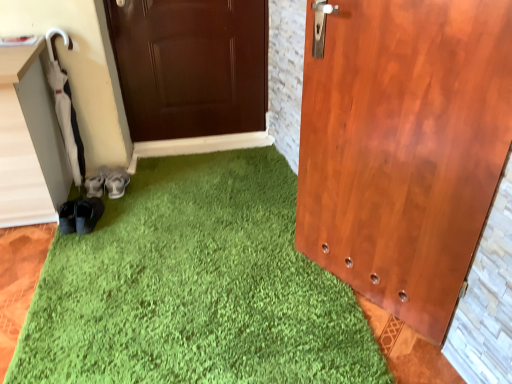
Where is `suede gray shoes at lower left, the 2th footwear in the right-to-left sequence`? The width and height of the screenshot is (512, 384). suede gray shoes at lower left, the 2th footwear in the right-to-left sequence is located at coordinates (96, 182).

The width and height of the screenshot is (512, 384). What do you see at coordinates (96, 182) in the screenshot? I see `suede gray shoes at lower left, the 1th footwear viewed from the left` at bounding box center [96, 182].

Describe the element at coordinates (116, 182) in the screenshot. I see `gray fabric shoes at lower left, positioned as the first footwear in right-to-left order` at that location.

How much space does gray fabric shoes at lower left, positioned as the first footwear in right-to-left order, occupy horizontally?

gray fabric shoes at lower left, positioned as the first footwear in right-to-left order, is 12.84 inches wide.

Locate an element on the screen. gray fabric shoes at lower left, positioned as the first footwear in right-to-left order is located at coordinates (116, 182).

The height and width of the screenshot is (384, 512). Find the location of `suede gray shoes at lower left, the 1th footwear viewed from the left`. suede gray shoes at lower left, the 1th footwear viewed from the left is located at coordinates (96, 182).

Is suede gray shoes at lower left, the 2th footwear in the right-to-left sequence, to the right of gray fabric shoes at lower left, which ranks as the second footwear in left-to-right order, from the viewer's perspective?

Incorrect, suede gray shoes at lower left, the 2th footwear in the right-to-left sequence, is not on the right side of gray fabric shoes at lower left, which ranks as the second footwear in left-to-right order.

Who is more distant, suede gray shoes at lower left, the 2th footwear in the right-to-left sequence, or gray fabric shoes at lower left, positioned as the first footwear in right-to-left order?

suede gray shoes at lower left, the 2th footwear in the right-to-left sequence, is more distant.

Which is farther, (92, 177) or (118, 184)?

The point (92, 177) is more distant.

From the image's perspective, is suede gray shoes at lower left, the 1th footwear viewed from the left, positioned above or below gray fabric shoes at lower left, which ranks as the second footwear in left-to-right order?

Clearly, from the image's perspective, suede gray shoes at lower left, the 1th footwear viewed from the left, is below gray fabric shoes at lower left, which ranks as the second footwear in left-to-right order.

From a real-world perspective, is suede gray shoes at lower left, the 1th footwear viewed from the left, positioned above or below gray fabric shoes at lower left, which ranks as the second footwear in left-to-right order?

From a real-world perspective, suede gray shoes at lower left, the 1th footwear viewed from the left, is physically below gray fabric shoes at lower left, which ranks as the second footwear in left-to-right order.

Based on the photo, does suede gray shoes at lower left, the 2th footwear in the right-to-left sequence, have a greater width compared to gray fabric shoes at lower left, which ranks as the second footwear in left-to-right order?

No, suede gray shoes at lower left, the 2th footwear in the right-to-left sequence, is not wider than gray fabric shoes at lower left, which ranks as the second footwear in left-to-right order.

Considering the relative sizes of suede gray shoes at lower left, the 2th footwear in the right-to-left sequence, and gray fabric shoes at lower left, positioned as the first footwear in right-to-left order, in the image provided, is suede gray shoes at lower left, the 2th footwear in the right-to-left sequence, shorter than gray fabric shoes at lower left, positioned as the first footwear in right-to-left order,?

Incorrect, the height of suede gray shoes at lower left, the 2th footwear in the right-to-left sequence, does not fall short of that of gray fabric shoes at lower left, positioned as the first footwear in right-to-left order.

Considering the relative sizes of suede gray shoes at lower left, the 1th footwear viewed from the left, and gray fabric shoes at lower left, positioned as the first footwear in right-to-left order, in the image provided, is suede gray shoes at lower left, the 1th footwear viewed from the left, bigger than gray fabric shoes at lower left, positioned as the first footwear in right-to-left order,?

Actually, suede gray shoes at lower left, the 1th footwear viewed from the left, might be smaller than gray fabric shoes at lower left, positioned as the first footwear in right-to-left order.

Would you say gray fabric shoes at lower left, which ranks as the second footwear in left-to-right order, is part of suede gray shoes at lower left, the 1th footwear viewed from the left,'s contents?

No.

Is suede gray shoes at lower left, the 1th footwear viewed from the left, placed right next to gray fabric shoes at lower left, positioned as the first footwear in right-to-left order?

Yes, suede gray shoes at lower left, the 1th footwear viewed from the left, is right next to gray fabric shoes at lower left, positioned as the first footwear in right-to-left order, and making contact.

Is suede gray shoes at lower left, the 2th footwear in the right-to-left sequence, oriented towards gray fabric shoes at lower left, positioned as the first footwear in right-to-left order?

No, suede gray shoes at lower left, the 2th footwear in the right-to-left sequence, does not turn towards gray fabric shoes at lower left, positioned as the first footwear in right-to-left order.

How many degrees apart are the facing directions of suede gray shoes at lower left, the 1th footwear viewed from the left, and gray fabric shoes at lower left, which ranks as the second footwear in left-to-right order?

1.16 degrees separate the facing orientations of suede gray shoes at lower left, the 1th footwear viewed from the left, and gray fabric shoes at lower left, which ranks as the second footwear in left-to-right order.

Could you measure the distance between suede gray shoes at lower left, the 2th footwear in the right-to-left sequence, and gray fabric shoes at lower left, positioned as the first footwear in right-to-left order?

suede gray shoes at lower left, the 2th footwear in the right-to-left sequence, is 2.66 inches away from gray fabric shoes at lower left, positioned as the first footwear in right-to-left order.

Locate an element on the screen. The width and height of the screenshot is (512, 384). footwear that appears above the suede gray shoes at lower left, the 1th footwear viewed from the left (from a real-world perspective) is located at coordinates (116, 182).

Based on their positions, is gray fabric shoes at lower left, which ranks as the second footwear in left-to-right order, located to the left or right of suede gray shoes at lower left, the 2th footwear in the right-to-left sequence?

gray fabric shoes at lower left, which ranks as the second footwear in left-to-right order, is to the right of suede gray shoes at lower left, the 2th footwear in the right-to-left sequence.

Which object is further away from the camera, gray fabric shoes at lower left, which ranks as the second footwear in left-to-right order, or suede gray shoes at lower left, the 1th footwear viewed from the left?

suede gray shoes at lower left, the 1th footwear viewed from the left, is further away from the camera.

Is point (119, 186) positioned in front of point (97, 169)?

Yes.

Consider the image. From the image's perspective, between gray fabric shoes at lower left, which ranks as the second footwear in left-to-right order, and suede gray shoes at lower left, the 2th footwear in the right-to-left sequence, who is located below?

suede gray shoes at lower left, the 2th footwear in the right-to-left sequence, is shown below in the image.

From a real-world perspective, between gray fabric shoes at lower left, positioned as the first footwear in right-to-left order, and suede gray shoes at lower left, the 1th footwear viewed from the left, who is vertically lower?

suede gray shoes at lower left, the 1th footwear viewed from the left, is physically lower.

Considering the sizes of gray fabric shoes at lower left, which ranks as the second footwear in left-to-right order, and suede gray shoes at lower left, the 2th footwear in the right-to-left sequence, in the image, is gray fabric shoes at lower left, which ranks as the second footwear in left-to-right order, wider or thinner than suede gray shoes at lower left, the 2th footwear in the right-to-left sequence,?

In the image, gray fabric shoes at lower left, which ranks as the second footwear in left-to-right order, appears to be wider than suede gray shoes at lower left, the 2th footwear in the right-to-left sequence.

In the scene shown: Does gray fabric shoes at lower left, positioned as the first footwear in right-to-left order, have a lesser height compared to suede gray shoes at lower left, the 2th footwear in the right-to-left sequence?

Yes, gray fabric shoes at lower left, positioned as the first footwear in right-to-left order, is shorter than suede gray shoes at lower left, the 2th footwear in the right-to-left sequence.

Considering the relative sizes of gray fabric shoes at lower left, positioned as the first footwear in right-to-left order, and suede gray shoes at lower left, the 2th footwear in the right-to-left sequence, in the image provided, is gray fabric shoes at lower left, positioned as the first footwear in right-to-left order, bigger than suede gray shoes at lower left, the 2th footwear in the right-to-left sequence,?

Yes.

Does gray fabric shoes at lower left, positioned as the first footwear in right-to-left order, contain suede gray shoes at lower left, the 2th footwear in the right-to-left sequence?

No, suede gray shoes at lower left, the 2th footwear in the right-to-left sequence, is not a part of gray fabric shoes at lower left, positioned as the first footwear in right-to-left order.

Is gray fabric shoes at lower left, which ranks as the second footwear in left-to-right order, beside suede gray shoes at lower left, the 2th footwear in the right-to-left sequence?

Yes, gray fabric shoes at lower left, which ranks as the second footwear in left-to-right order, is next to suede gray shoes at lower left, the 2th footwear in the right-to-left sequence.

Looking at this image, does gray fabric shoes at lower left, which ranks as the second footwear in left-to-right order, turn towards suede gray shoes at lower left, the 2th footwear in the right-to-left sequence?

No, gray fabric shoes at lower left, which ranks as the second footwear in left-to-right order, is not oriented towards suede gray shoes at lower left, the 2th footwear in the right-to-left sequence.

Identify the location of footwear above the suede gray shoes at lower left, the 1th footwear viewed from the left (from a real-world perspective). (116, 182).

Where is `footwear that is on the right side of suede gray shoes at lower left, the 1th footwear viewed from the left`? footwear that is on the right side of suede gray shoes at lower left, the 1th footwear viewed from the left is located at coordinates (116, 182).

The image size is (512, 384). Find the location of `footwear that is under the gray fabric shoes at lower left, which ranks as the second footwear in left-to-right order (from a real-world perspective)`. footwear that is under the gray fabric shoes at lower left, which ranks as the second footwear in left-to-right order (from a real-world perspective) is located at coordinates (96, 182).